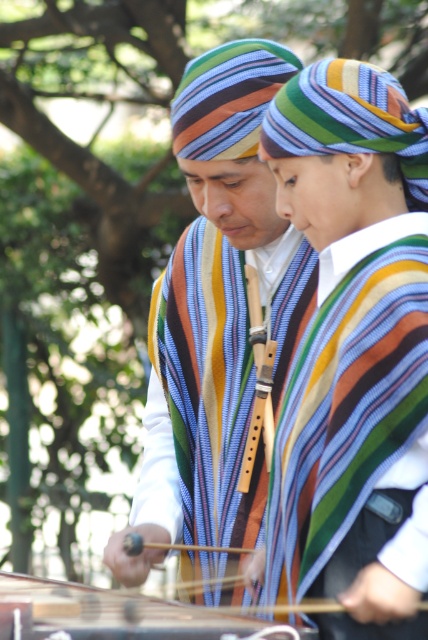
Question: Which point is farther to the camera?

Choices:
 (A) wooden stringed instrument at center
 (B) striped fabric headscarf at center

Answer: (B)

Question: Which object is closer to the camera taking this photo?

Choices:
 (A) striped fabric headscarf at center
 (B) wooden stringed instrument at center

Answer: (B)

Question: Can you confirm if striped fabric headscarf at center is positioned below wooden stringed instrument at center?

Choices:
 (A) no
 (B) yes

Answer: (A)

Question: Is striped fabric headscarf at center above wooden stringed instrument at center?

Choices:
 (A) yes
 (B) no

Answer: (A)

Question: Can you confirm if striped fabric headscarf at center is smaller than wooden stringed instrument at center?

Choices:
 (A) yes
 (B) no

Answer: (B)